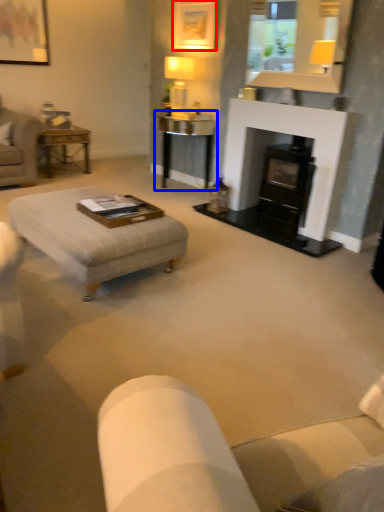
Question: Which of the following is the farthest to the observer, picture frame (highlighted by a red box) or table (highlighted by a blue box)?

Choices:
 (A) picture frame
 (B) table

Answer: (B)